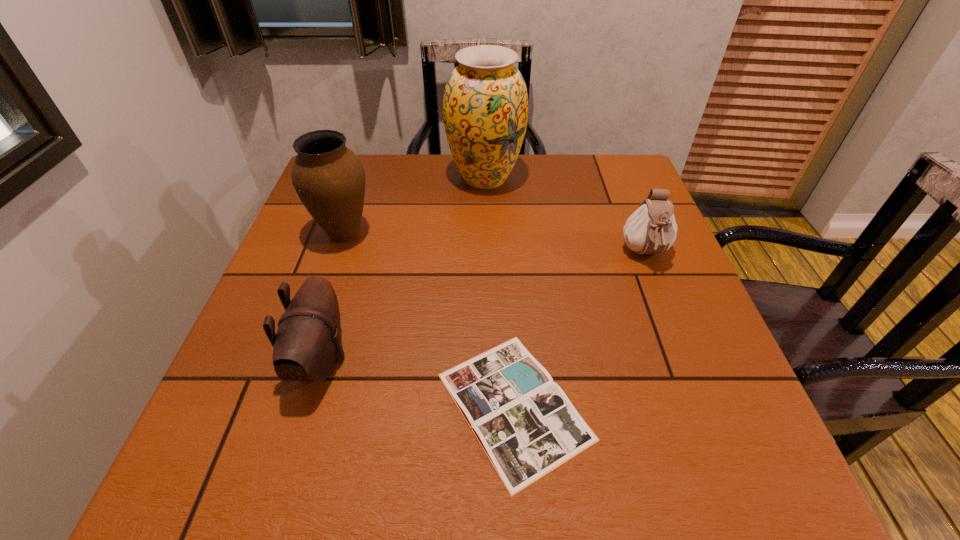
Image resolution: width=960 pixels, height=540 pixels. Identify the location of vase. (485, 106).

Identify the location of the tallest object. The height and width of the screenshot is (540, 960). (485, 106).

Locate an element on the screen. The image size is (960, 540). the second tallest object is located at coordinates (329, 179).

At what (x,y) coordinates should I click in order to perform the action: click on the nearer pouch. Please return your answer as a coordinate pair (x, y). Looking at the image, I should click on click(307, 345).

You are a GUI agent. You are given a task and a screenshot of the screen. Output one action in this format:
    pyautogui.click(x=<x>, y=<y>)
    Task: Click on the right pouch
    This screenshot has width=960, height=540.
    Given the screenshot: What is the action you would take?
    pyautogui.click(x=651, y=229)

Locate an element on the screen. This screenshot has width=960, height=540. the rightmost object is located at coordinates (651, 229).

The width and height of the screenshot is (960, 540). In order to click on the shortest object in this screenshot , I will do `click(525, 423)`.

Where is `vacant region located on the right of the tallest object`? The height and width of the screenshot is (540, 960). vacant region located on the right of the tallest object is located at coordinates (552, 178).

The width and height of the screenshot is (960, 540). What are the coordinates of `free spot located on the right of the urn` in the screenshot? It's located at (401, 233).

Locate an element on the screen. The width and height of the screenshot is (960, 540). vacant position located 0.260m with the flap open on the left pouch is located at coordinates (492, 360).